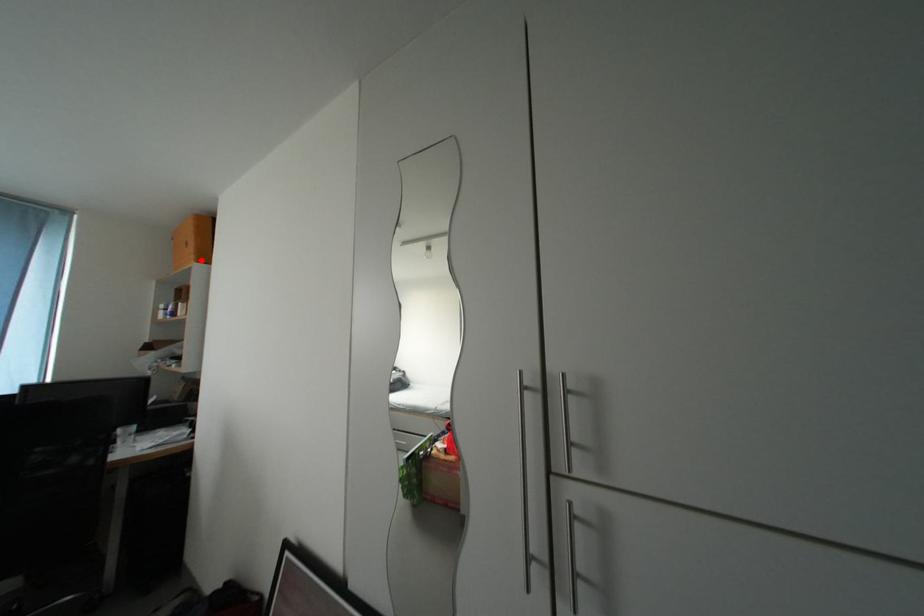
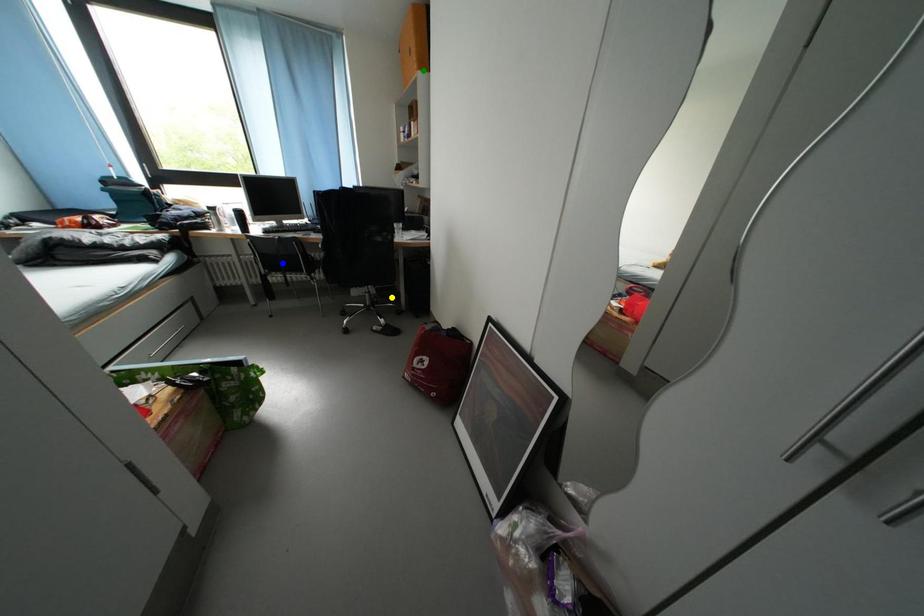
Question: I am providing you with two images of the same scene from different viewpoints. A red point is marked on the first image. You are given multiple points on the second image. In image 2, which mark is for the same physical point as the one in image 1?

Choices:
 (A) green point
 (B) blue point
 (C) yellow point

Answer: (A)